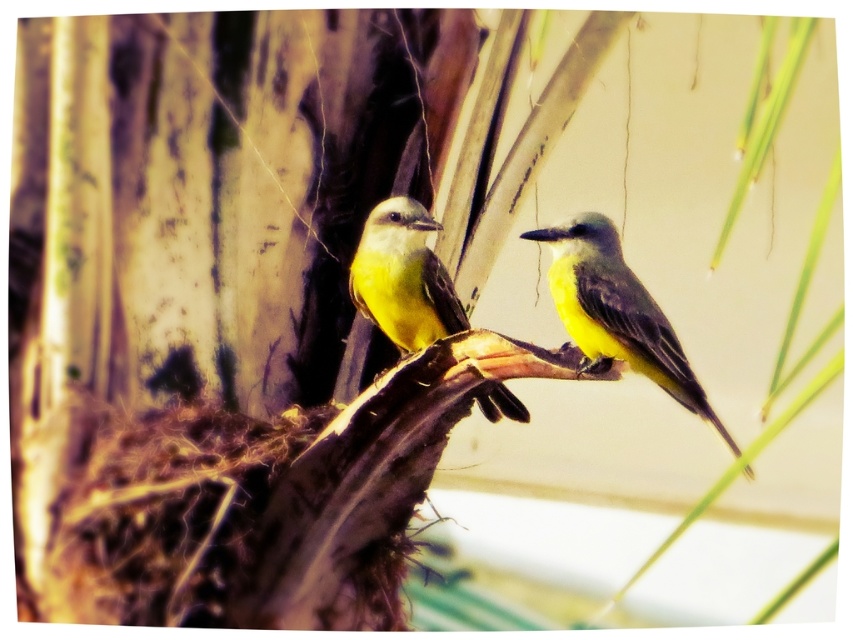
Is point (554, 237) farther from viewer compared to point (432, 259)?

No.

Can you confirm if yellow matte bird at center is taller than yellow matte bird at left?

Correct, yellow matte bird at center is much taller as yellow matte bird at left.

Who is more forward, (636, 300) or (425, 304)?

Point (636, 300) is more forward.

At what (x,y) coordinates should I click in order to perform the action: click on yellow matte bird at center. Please return your answer as a coordinate pair (x, y). Image resolution: width=853 pixels, height=640 pixels. Looking at the image, I should click on (616, 310).